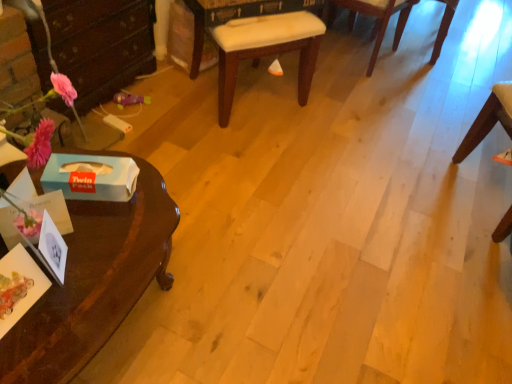
You are a GUI agent. You are given a task and a screenshot of the screen. Output one action in this format:
    pyautogui.click(x=<x>, y=<y>)
    Task: Click on the free space underneath wooden chair at upper right, which ranks as the first chair in right-to-left order (from a real-world perspective)
    
    Given the screenshot: What is the action you would take?
    pyautogui.click(x=418, y=43)